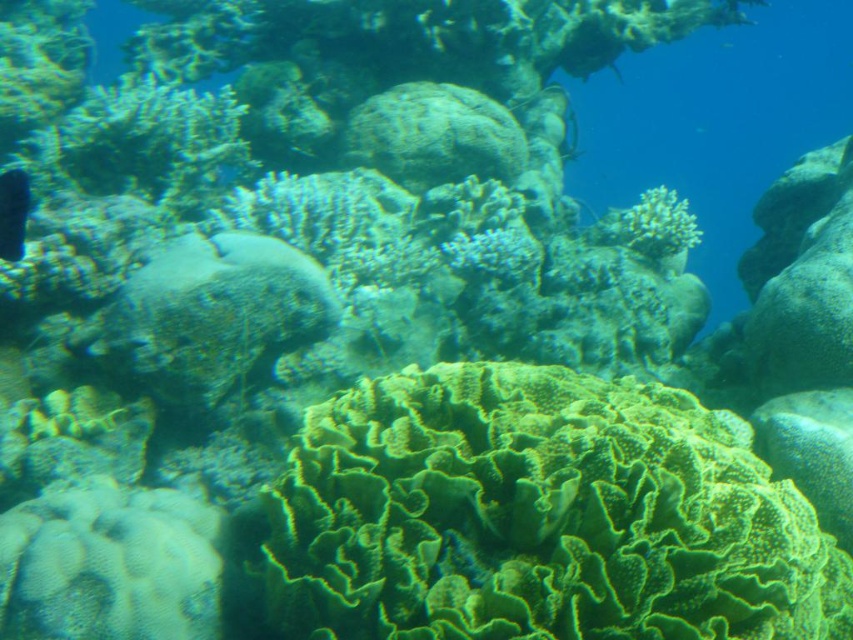
You are a marine biologist observing an underwater coral reef. You notice a green textured coral at center and a shiny black fish at left. Based on their positions, which object is closer to the left side of your view?

The shiny black fish at left is closer to the left side of the view since it is positioned to the left of the green textured coral at center.

You are a scuba diver with a camera. You want to take a closeup photo of the green textured coral at center. The camera requires the subject to be within 5 feet to focus properly. Can you take the photo without moving closer?

The green textured coral at center is 5.27 feet away from the camera. Since the camera requires the subject to be within 5 feet to focus properly, the distance is slightly too far. You would need to move closer to ensure proper focus.